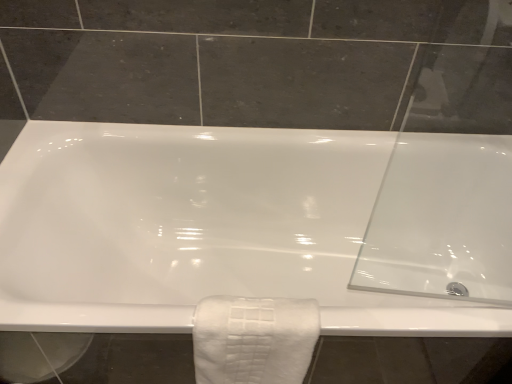
I want to click on vacant region above white textured towel at lower center (from a real-world perspective), so click(x=248, y=320).